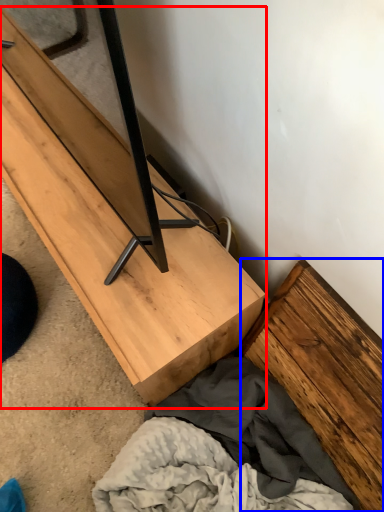
Question: Which object appears farthest to the camera in this image, furniture (highlighted by a red box) or plank (highlighted by a blue box)?

Choices:
 (A) furniture
 (B) plank

Answer: (A)